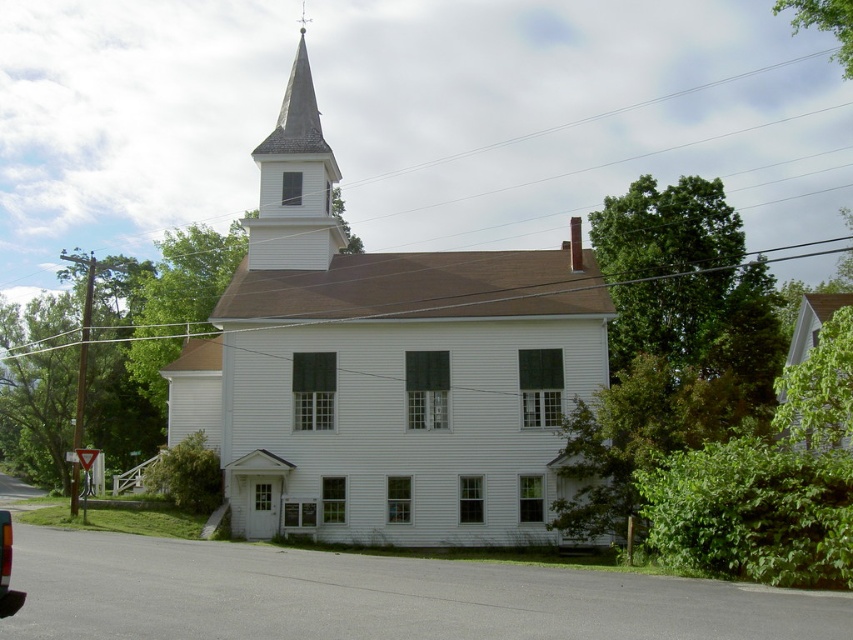
Question: Considering the real-world distances, which object is farthest from the white wood church at center?

Choices:
 (A) green leafy tree at upper right
 (B) metallic red taillight at lower left

Answer: (B)

Question: Does green leafy tree at upper right appear under metallic red taillight at lower left?

Choices:
 (A) yes
 (B) no

Answer: (B)

Question: Does white wood spire at upper center appear under metallic red taillight at lower left?

Choices:
 (A) yes
 (B) no

Answer: (B)

Question: Which point is closer to the camera?

Choices:
 (A) (552, 493)
 (B) (9, 524)

Answer: (B)

Question: Which of the following is the farthest from the observer?

Choices:
 (A) metallic red taillight at lower left
 (B) green leafy tree at upper right

Answer: (B)

Question: Does white wood spire at upper center lie behind green leafy tree at upper right?

Choices:
 (A) no
 (B) yes

Answer: (B)